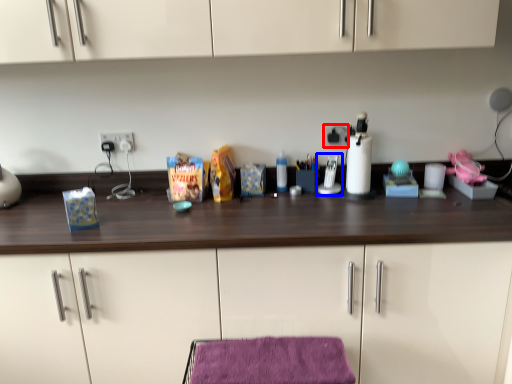
Question: Among these objects, which one is farthest to the camera, electric outlet (highlighted by a red box) or appliance (highlighted by a blue box)?

Choices:
 (A) electric outlet
 (B) appliance

Answer: (A)